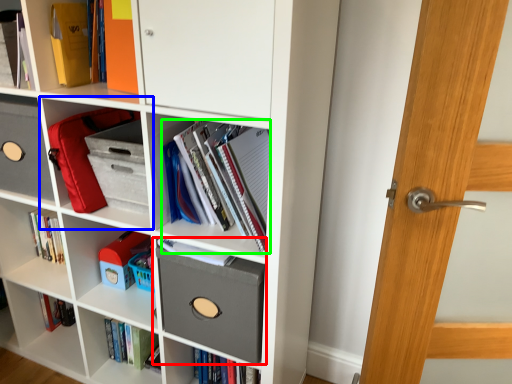
Question: Based on their relative distances, which object is farther from shelf (highlighted by a red box)? Choose from shelf (highlighted by a blue box) and book (highlighted by a green box).

Choices:
 (A) shelf
 (B) book

Answer: (A)